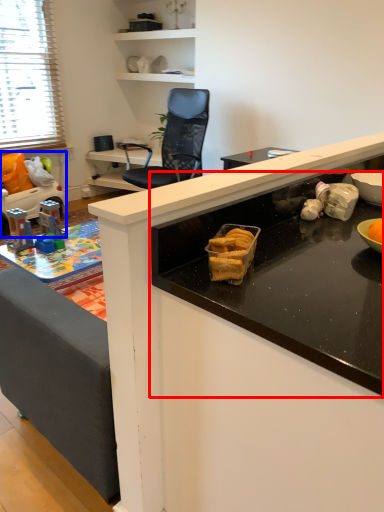
Question: Among these objects, which one is nearest to the camera, countertop (highlighted by a red box) or toy (highlighted by a blue box)?

Choices:
 (A) countertop
 (B) toy

Answer: (A)